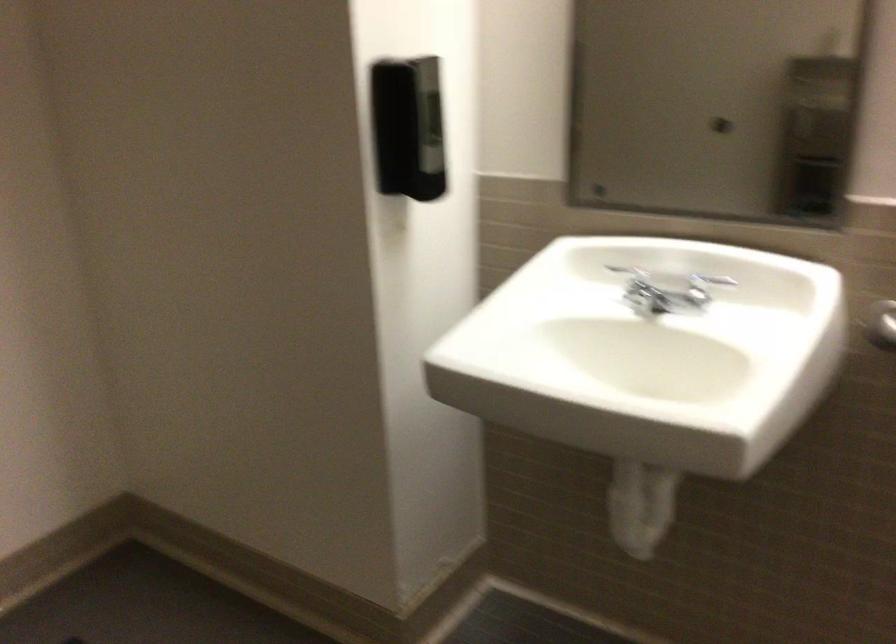
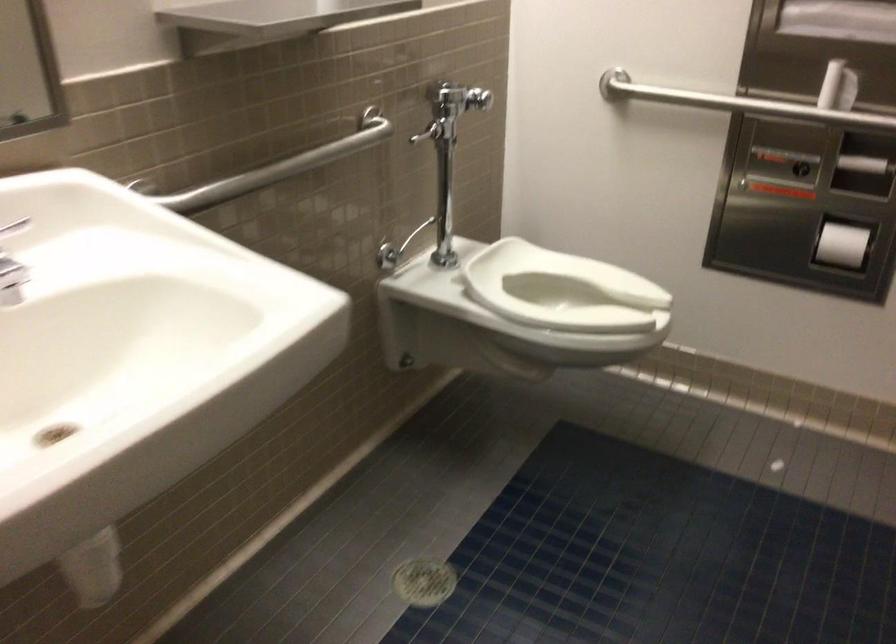
The images are taken continuously from a first-person perspective. In which direction is your viewpoint rotating?

The rotation direction of the camera is right-down.